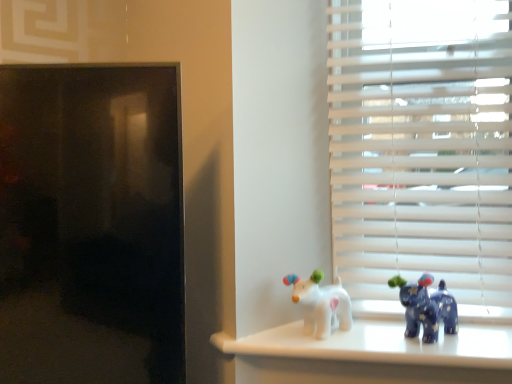
Question: In which direction should I rotate to look at white glossy dog at center, the second toy in the right-to-left sequence?

Choices:
 (A) right
 (B) left

Answer: (A)

Question: Does blue glossy elephant at right, arranged as the first toy when viewed from the right, have a greater height compared to white matte blinds at right?

Choices:
 (A) yes
 (B) no

Answer: (B)

Question: Does blue glossy elephant at right, acting as the second toy starting from the left, have a larger size compared to white matte blinds at right?

Choices:
 (A) yes
 (B) no

Answer: (B)

Question: From the image's perspective, is blue glossy elephant at right, acting as the second toy starting from the left, over white matte blinds at right?

Choices:
 (A) yes
 (B) no

Answer: (B)

Question: Is blue glossy elephant at right, acting as the second toy starting from the left, located outside white matte blinds at right?

Choices:
 (A) yes
 (B) no

Answer: (A)

Question: Is blue glossy elephant at right, arranged as the first toy when viewed from the right, turned away from white matte blinds at right?

Choices:
 (A) yes
 (B) no

Answer: (A)

Question: Is blue glossy elephant at right, arranged as the first toy when viewed from the right, to the left of white matte blinds at right from the viewer's perspective?

Choices:
 (A) no
 (B) yes

Answer: (B)

Question: Can you confirm if white matte blinds at right is positioned to the right of white glossy dog at center, positioned as the 1th toy in left-to-right order?

Choices:
 (A) no
 (B) yes

Answer: (B)

Question: From the image's perspective, is white matte blinds at right beneath white glossy dog at center, the second toy in the right-to-left sequence?

Choices:
 (A) no
 (B) yes

Answer: (A)

Question: Is white matte blinds at right taller than white glossy dog at center, positioned as the 1th toy in left-to-right order?

Choices:
 (A) yes
 (B) no

Answer: (A)

Question: Could white glossy dog at center, the second toy in the right-to-left sequence, be considered to be inside white matte blinds at right?

Choices:
 (A) yes
 (B) no

Answer: (B)

Question: Can you confirm if white matte blinds at right is shorter than white glossy dog at center, the second toy in the right-to-left sequence?

Choices:
 (A) no
 (B) yes

Answer: (A)

Question: Does white matte blinds at right turn towards white glossy dog at center, positioned as the 1th toy in left-to-right order?

Choices:
 (A) yes
 (B) no

Answer: (B)

Question: Can you confirm if white matte blinds at right is thinner than blue glossy elephant at right, arranged as the first toy when viewed from the right?

Choices:
 (A) yes
 (B) no

Answer: (B)